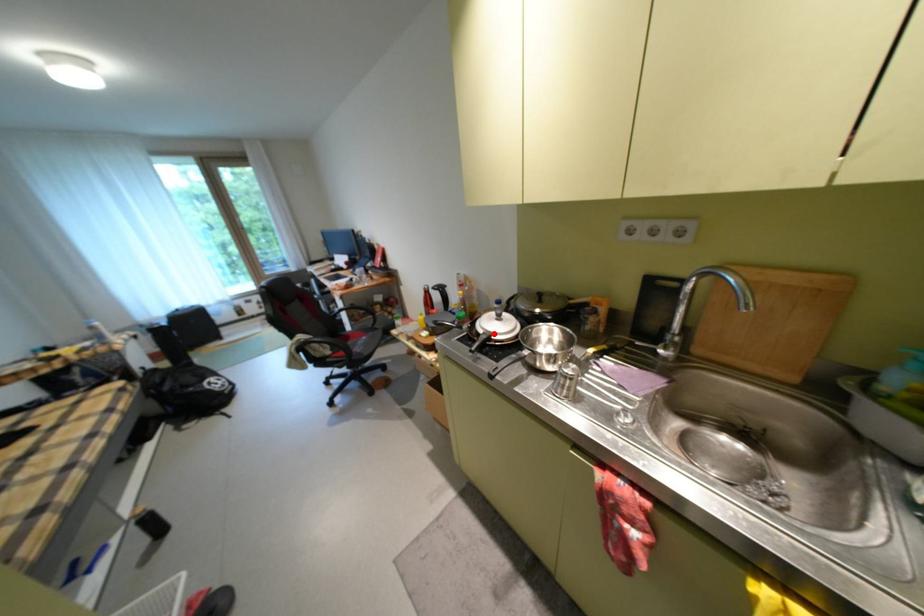
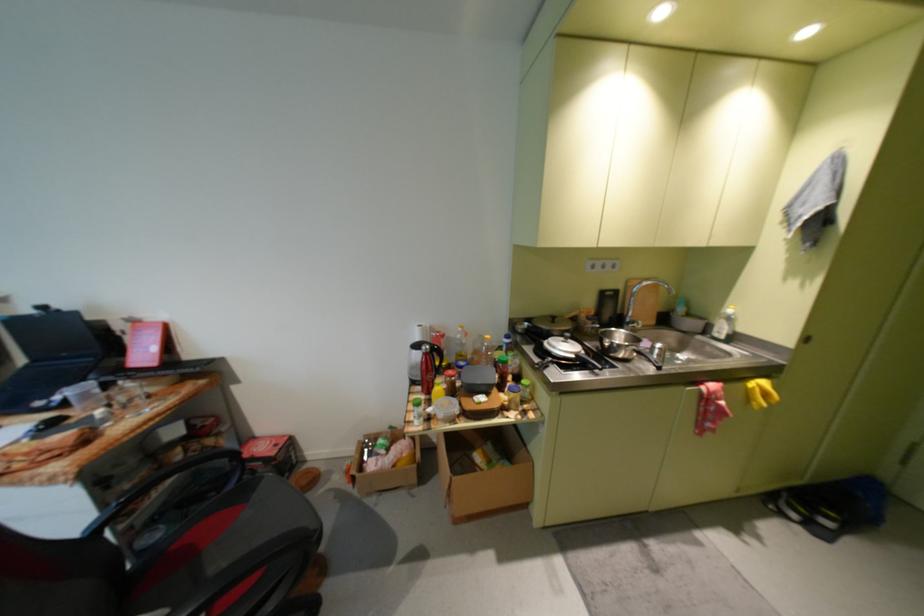
Question: I am providing you with two images of the same scene from different viewpoints. A red point is marked on the first image. Can you still see the location of the red point in image 2?

Choices:
 (A) Yes
 (B) No

Answer: (A)